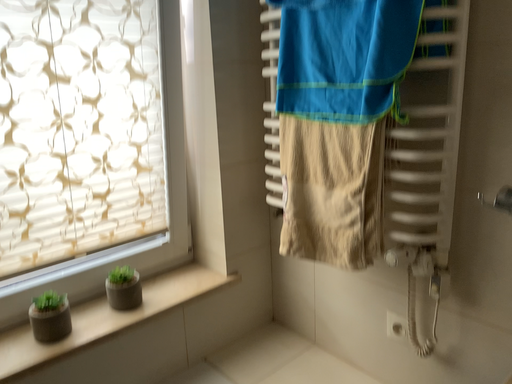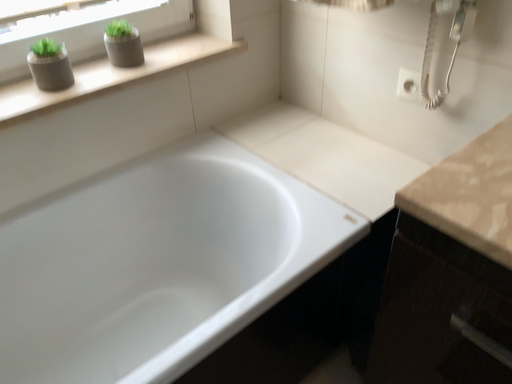
Question: How did the camera likely rotate when shooting the video?

Choices:
 (A) rotated upward
 (B) rotated downward

Answer: (B)